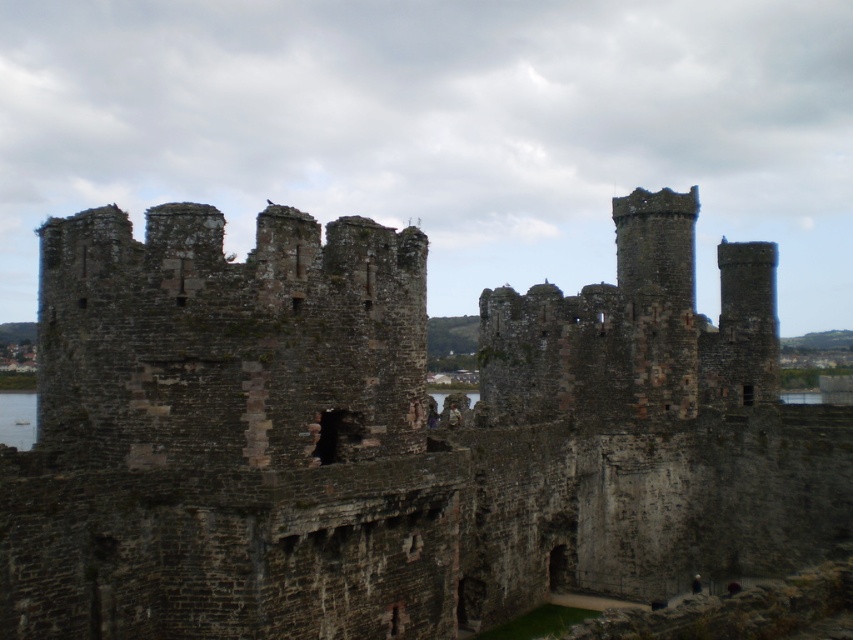
Question: In this image, where is dark stone castle at center located relative to clear water at lower left?

Choices:
 (A) below
 (B) above

Answer: (B)

Question: Which is farther from the clear water at lower left?

Choices:
 (A) camouflage fabric person at center
 (B) dark stone castle at center

Answer: (A)

Question: Is dark stone castle at center further to the viewer compared to camouflage fabric person at center?

Choices:
 (A) yes
 (B) no

Answer: (B)

Question: Can you confirm if dark stone castle at center is positioned to the left of clear water at lower left?

Choices:
 (A) no
 (B) yes

Answer: (A)

Question: Which object is positioned farthest from the dark stone castle at center?

Choices:
 (A) camouflage fabric person at center
 (B) clear water at lower left

Answer: (B)

Question: Estimate the real-world distances between objects in this image. Which object is farther from the dark stone castle at center?

Choices:
 (A) clear water at lower left
 (B) camouflage fabric person at center

Answer: (A)